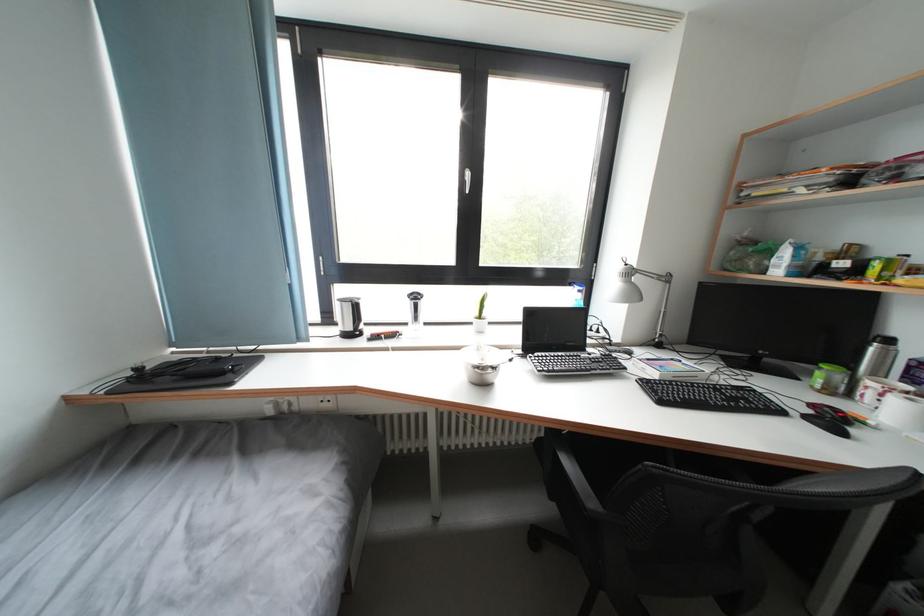
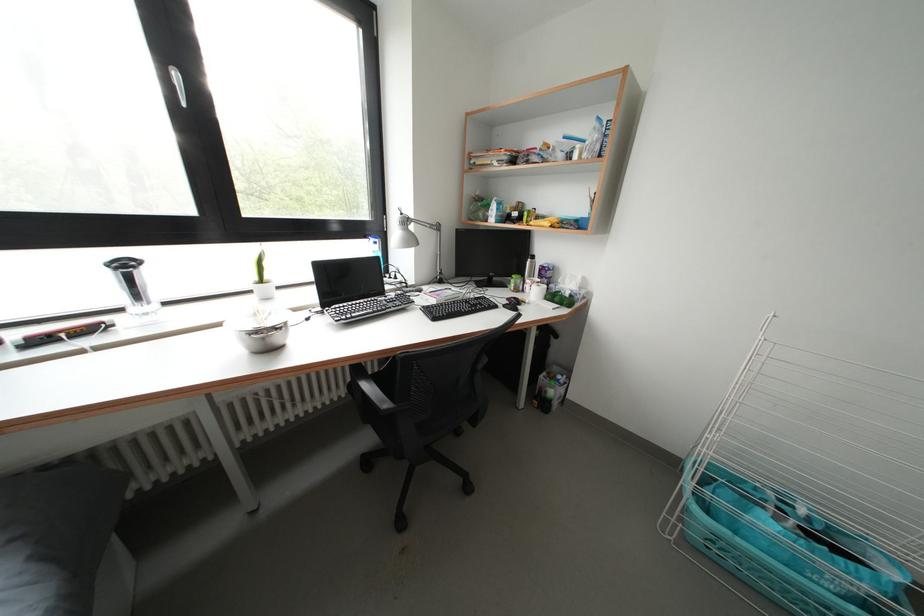
The point at (421, 302) is marked in the first image. Where is the corresponding point in the second image?

(131, 270)